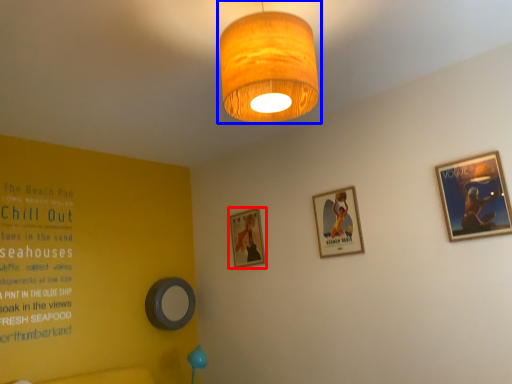
Question: Among these objects, which one is farthest to the camera, picture frame (highlighted by a red box) or lamp (highlighted by a blue box)?

Choices:
 (A) picture frame
 (B) lamp

Answer: (A)